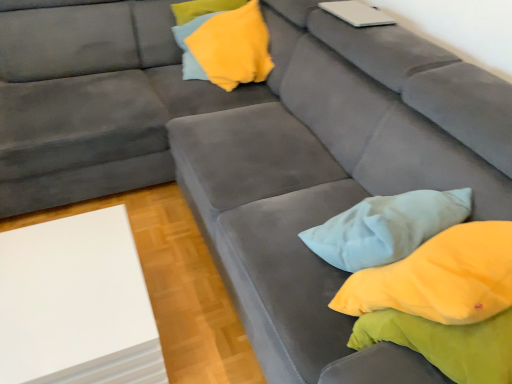
Find the location of a particular element. Image resolution: width=512 pixels, height=384 pixels. yellow fabric pillow at upper center is located at coordinates (233, 47).

The height and width of the screenshot is (384, 512). Identify the location of white matte board at lower left. (76, 304).

Where is `white matte laptop at upper right`? white matte laptop at upper right is located at coordinates (357, 13).

Does white matte board at lower left have a greater width compared to white matte laptop at upper right?

Yes, white matte board at lower left is wider than white matte laptop at upper right.

From the image's perspective, is white matte board at lower left located above or below white matte laptop at upper right?

white matte board at lower left is situated lower than white matte laptop at upper right in the image.

Is white matte board at lower left in contact with white matte laptop at upper right?

They are not placed beside each other.

Considering the sizes of objects yellow fabric pillow at upper center and white matte laptop at upper right in the image provided, who is shorter, yellow fabric pillow at upper center or white matte laptop at upper right?

Standing shorter between the two is white matte laptop at upper right.

Is yellow fabric pillow at upper center positioned with its back to white matte laptop at upper right?

yellow fabric pillow at upper center is not turned away from white matte laptop at upper right.

Could white matte laptop at upper right be considered to be inside yellow fabric pillow at upper center?

No.

Considering the positions of point (209, 44) and point (356, 14), is point (209, 44) closer or farther from the camera than point (356, 14)?

Point (209, 44) is positioned farther from the camera compared to point (356, 14).

From a real-world perspective, is white matte laptop at upper right positioned over yellow fabric pillow at upper center based on gravity?

Yes, from a real-world perspective, white matte laptop at upper right is over yellow fabric pillow at upper center

Which point is more forward, [345,21] or [203,29]?

The point [345,21] is more forward.

The height and width of the screenshot is (384, 512). What are the coordinates of `pillow that appears below the white matte laptop at upper right (from the image's perspective)` in the screenshot? It's located at (233, 47).

Between white matte laptop at upper right and white matte board at lower left, which one is positioned behind?

white matte laptop at upper right is further away from the camera.

Identify the location of table to the left of white matte laptop at upper right. (76, 304).

From the picture: Is white matte laptop at upper right at the left side of white matte board at lower left?

No, white matte laptop at upper right is not to the left of white matte board at lower left.

Is white matte laptop at upper right spatially inside white matte board at lower left, or outside of it?

white matte laptop at upper right is not enclosed by white matte board at lower left.

From the picture: Who is taller, white matte board at lower left or yellow fabric pillow at upper center?

white matte board at lower left is taller.

Consider the image. Is white matte board at lower left next to yellow fabric pillow at upper center?

white matte board at lower left and yellow fabric pillow at upper center are clearly separated.

From the image's perspective, which is above, white matte board at lower left or yellow fabric pillow at upper center?

yellow fabric pillow at upper center is shown above in the image.

Locate an element on the screen. The image size is (512, 384). pillow that is on the right side of white matte board at lower left is located at coordinates (233, 47).

Between yellow fabric pillow at upper center and white matte board at lower left, which one has more height?

With more height is white matte board at lower left.

Does yellow fabric pillow at upper center lie in front of white matte board at lower left?

No, the depth of yellow fabric pillow at upper center is greater than that of white matte board at lower left.

Where is `table that is in front of the yellow fabric pillow at upper center`? The image size is (512, 384). table that is in front of the yellow fabric pillow at upper center is located at coordinates (76, 304).

Find the location of `table located underneath the white matte laptop at upper right (from a real-world perspective)`. table located underneath the white matte laptop at upper right (from a real-world perspective) is located at coordinates (76, 304).

Where is `pillow located below the white matte laptop at upper right (from the image's perspective)`? This screenshot has height=384, width=512. pillow located below the white matte laptop at upper right (from the image's perspective) is located at coordinates (233, 47).

When comparing their distances from white matte laptop at upper right, does yellow fabric pillow at upper center or white matte board at lower left seem further?

white matte board at lower left is further to white matte laptop at upper right.

Considering their positions, is white matte board at lower left positioned further to white matte laptop at upper right than yellow fabric pillow at upper center?

The object further to white matte laptop at upper right is white matte board at lower left.

When comparing their distances from white matte board at lower left, does yellow fabric pillow at upper center or white matte laptop at upper right seem further?

→ white matte laptop at upper right lies further to white matte board at lower left than the other object.

Estimate the real-world distances between objects in this image. Which object is further from yellow fabric pillow at upper center, white matte laptop at upper right or white matte board at lower left?

Among the two, white matte board at lower left is located further to yellow fabric pillow at upper center.

Looking at the image, which one is located further to yellow fabric pillow at upper center, white matte board at lower left or white matte laptop at upper right?

Among the two, white matte board at lower left is located further to yellow fabric pillow at upper center.

Considering their positions, is white matte laptop at upper right positioned closer to white matte board at lower left than yellow fabric pillow at upper center?

Among the two, yellow fabric pillow at upper center is located nearer to white matte board at lower left.

Find the location of a particular element. pillow between white matte laptop at upper right and white matte board at lower left from top to bottom is located at coordinates (233, 47).